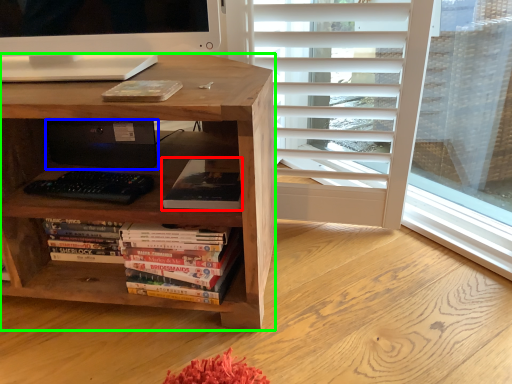
Question: Which object is the closest to the book (highlighted by a red box)? Choose among these: computer (highlighted by a blue box) or desk (highlighted by a green box).

Choices:
 (A) computer
 (B) desk

Answer: (B)